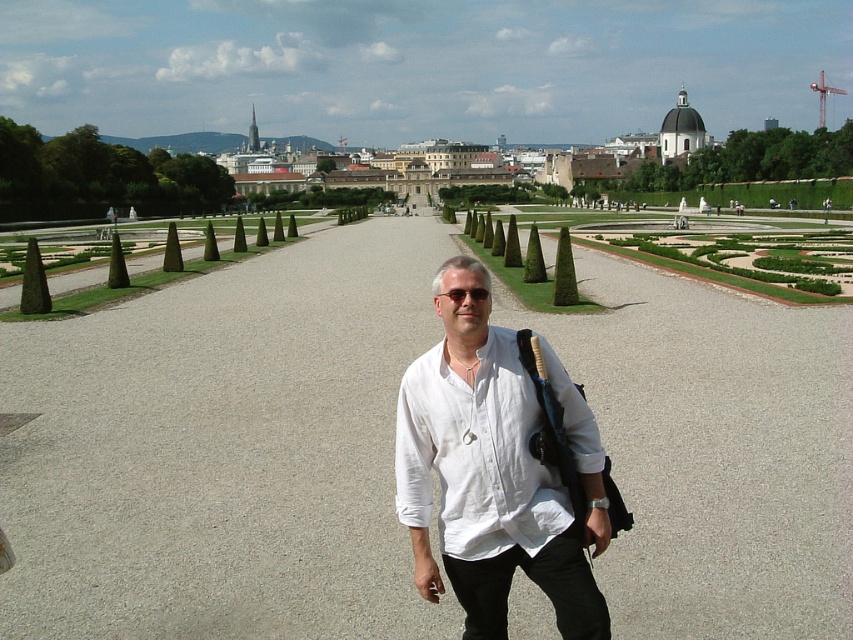
Does gray gravel path at center appear over green coniferous hedge at center?

Actually, gray gravel path at center is below green coniferous hedge at center.

Can you confirm if gray gravel path at center is smaller than green coniferous hedge at center?

Yes.

What do you see at coordinates (223, 451) in the screenshot? The height and width of the screenshot is (640, 853). I see `gray gravel path at center` at bounding box center [223, 451].

The width and height of the screenshot is (853, 640). In order to click on gray gravel path at center in this screenshot , I will do (x=223, y=451).

Which is above, green coniferous hedge at upper left or black plastic sunglasses at center?

green coniferous hedge at upper left

Is point (196, 209) more distant than point (457, 298)?

Yes, it is.

You are a GUI agent. You are given a task and a screenshot of the screen. Output one action in this format:
    pyautogui.click(x=<x>, y=<y>)
    Task: Click on the green coniferous hedge at upper left
    
    Given the screenshot: What is the action you would take?
    pyautogui.click(x=97, y=176)

Consider the image. Which is below, gray gravel path at center or white stone palace at upper center?

gray gravel path at center is below.

Can you confirm if gray gravel path at center is taller than white stone palace at upper center?

Incorrect, gray gravel path at center's height is not larger of white stone palace at upper center's.

Which is behind, point (44, 339) or point (437, 173)?

The point (437, 173) is more distant.

Where is `gray gravel path at center`? gray gravel path at center is located at coordinates (223, 451).